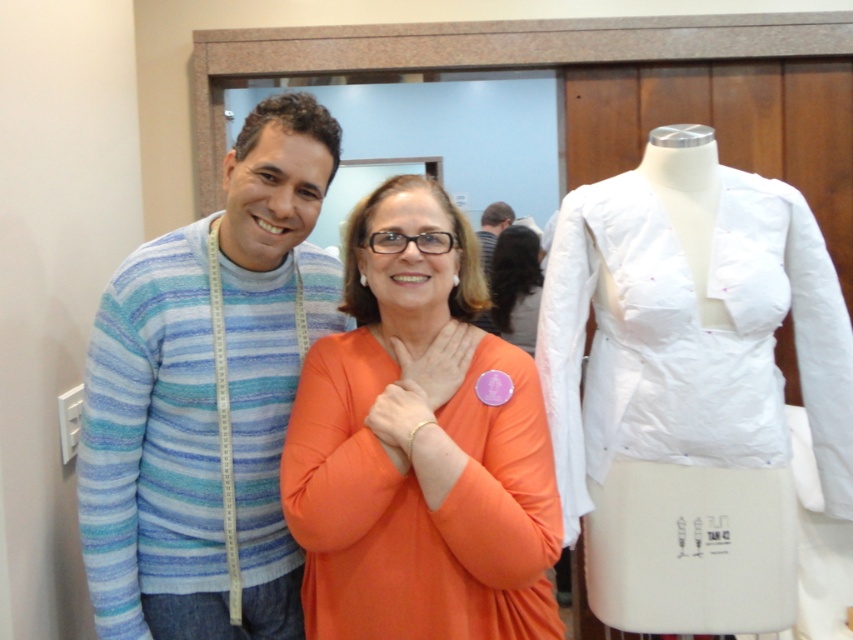
You are standing in a sewing workshop and see two people. One is wearing a horizontally striped sweater, and the other has an orange long sleeved top. There is a point at coordinate (419, 444). Which person is closest to this point?

The point at coordinate (419, 444) corresponds to the orange matte shirt at center, so the person wearing the orange long sleeved top is closest to this point.

You are a tailor trying to decide which garment to work on first. Both the striped cotton sweater at center and the orange fabric blouse at center are on your worktable. If you have a limited amount of fabric, which garment might require more fabric to repair or alter?

The striped cotton sweater at center is bigger than the orange fabric blouse at center, so it would require more fabric for repairs or alterations.

You are a tailor working in a workshop. You need to measure the distance between the striped cotton sweater at center and the orange fabric blouse at center to determine if they can be placed on a 10 feet long shelf. Can both items fit on the shelf if placed side by side?

The striped cotton sweater at center and orange fabric blouse at center are 8.32 feet apart from each other. Since the total distance between them is less than the 10 feet shelf length, they can be placed side by side on the shelf.